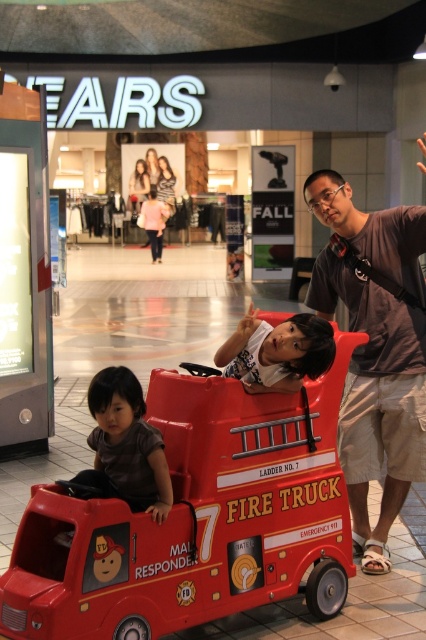
Question: Is shiny plastic fire truck at center wider than matte gray shirt at center?

Choices:
 (A) no
 (B) yes

Answer: (B)

Question: Does matte gray shirt at center have a lesser width compared to smooth white shirt at center?

Choices:
 (A) no
 (B) yes

Answer: (A)

Question: Among these objects, which one is farthest from the camera?

Choices:
 (A) matte gray shirt at center
 (B) matte brown shirt at lower left
 (C) smooth white shirt at center
 (D) shiny plastic fire truck at center

Answer: (A)

Question: Which point appears closest to the camera in this image?

Choices:
 (A) (327, 294)
 (B) (143, 440)

Answer: (B)

Question: Which point is farther from the camera taking this photo?

Choices:
 (A) (279, 356)
 (B) (160, 468)

Answer: (A)

Question: Is matte gray shirt at center positioned in front of matte brown shirt at lower left?

Choices:
 (A) yes
 (B) no

Answer: (B)